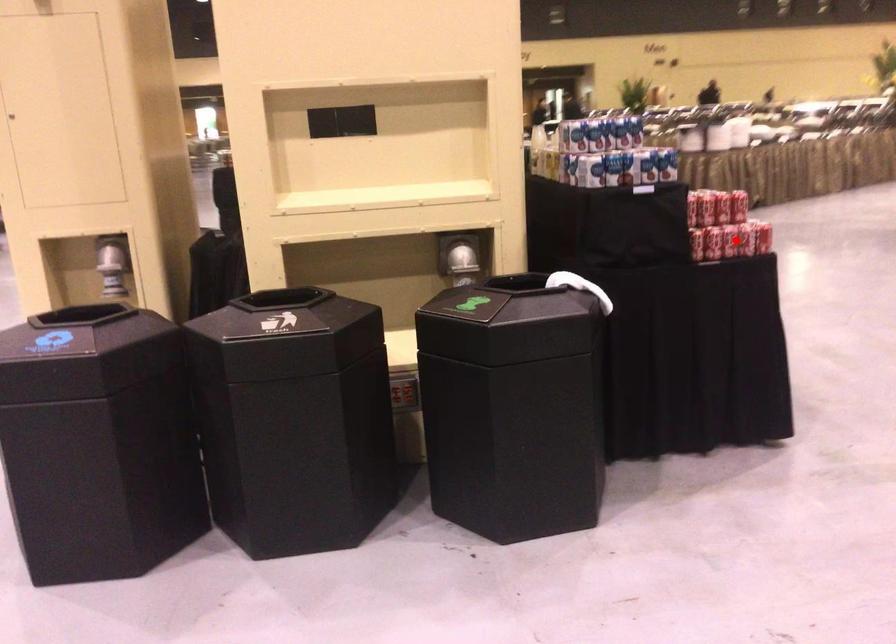
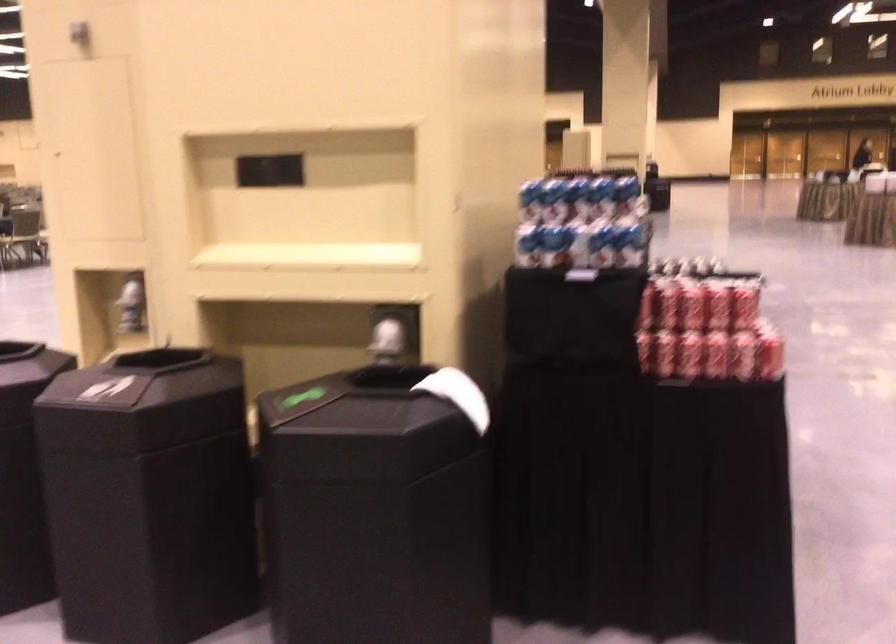
Question: I am providing you with two images of the same scene from different viewpoints. In image1, a red point is highlighted. Considering the same 3D point in image2, which of the following is correct?

Choices:
 (A) It is closer
 (B) It is farther

Answer: (A)